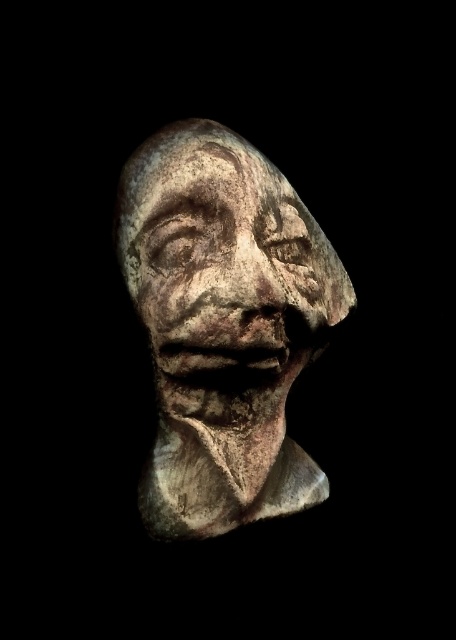
Is point (193, 192) positioned in front of point (234, 237)?

That is False.

Can you confirm if rustic stone bust at center is wider than rusty stone face at center?

Indeed, rustic stone bust at center has a greater width compared to rusty stone face at center.

You are a GUI agent. You are given a task and a screenshot of the screen. Output one action in this format:
    pyautogui.click(x=<x>, y=<y>)
    Task: Click on the rustic stone bust at center
    
    Given the screenshot: What is the action you would take?
    pyautogui.click(x=223, y=324)